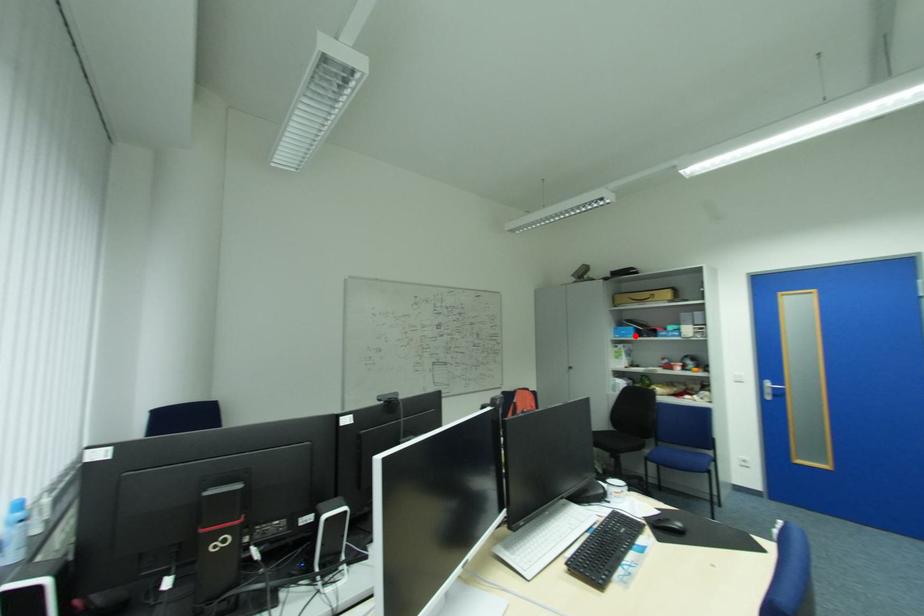
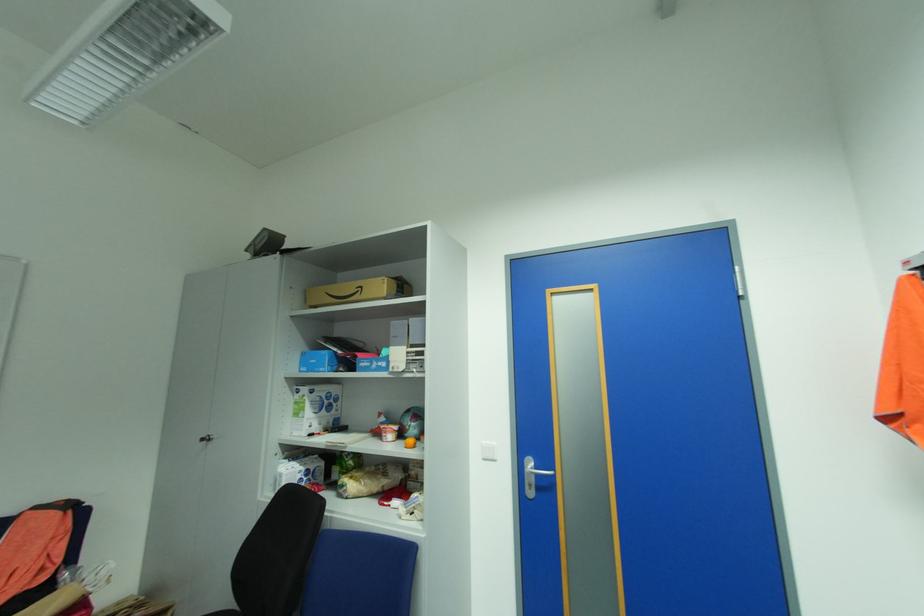
In the second image, find the point that corresponds to the highlighted location in the first image.

(327, 370)